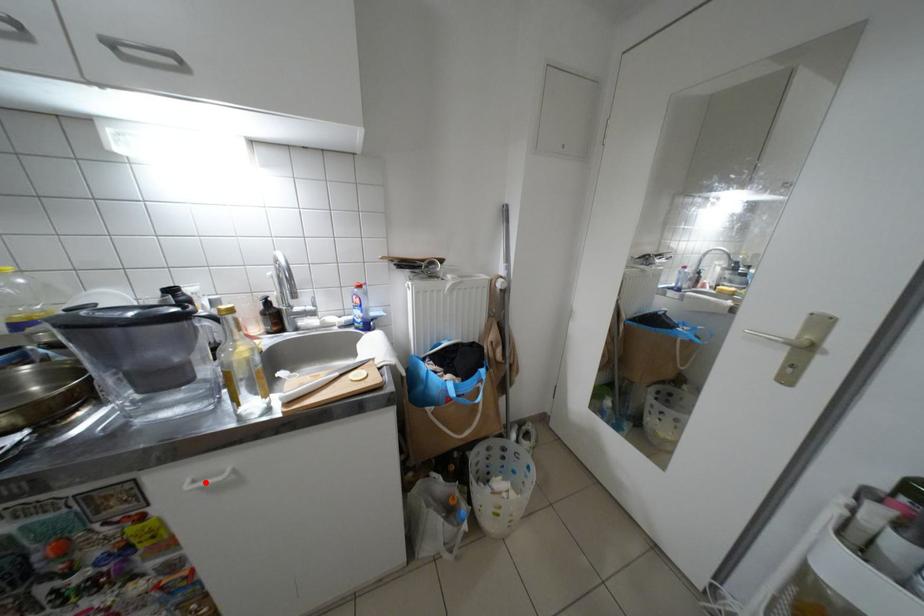
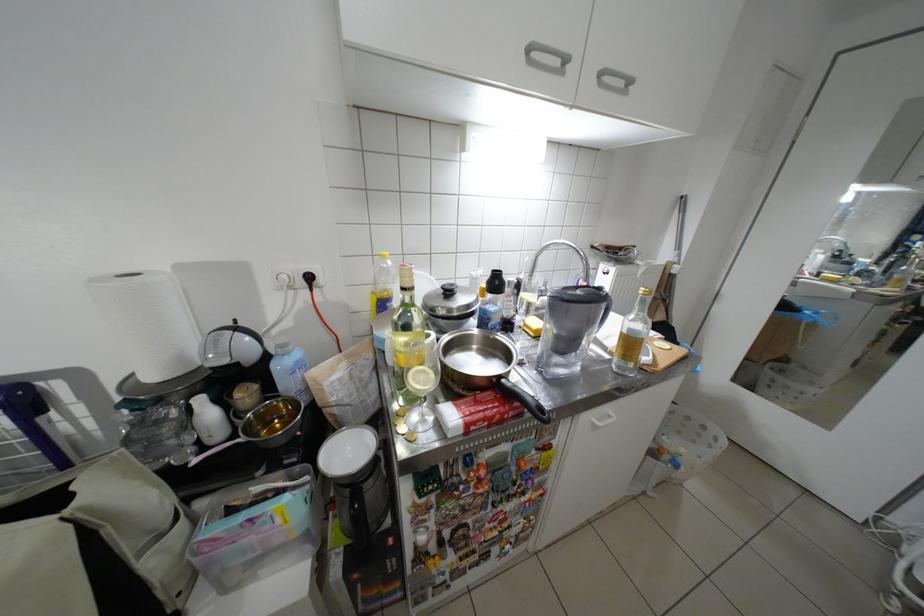
In the second image, find the point that corresponds to the highlighted location in the first image.

(610, 421)